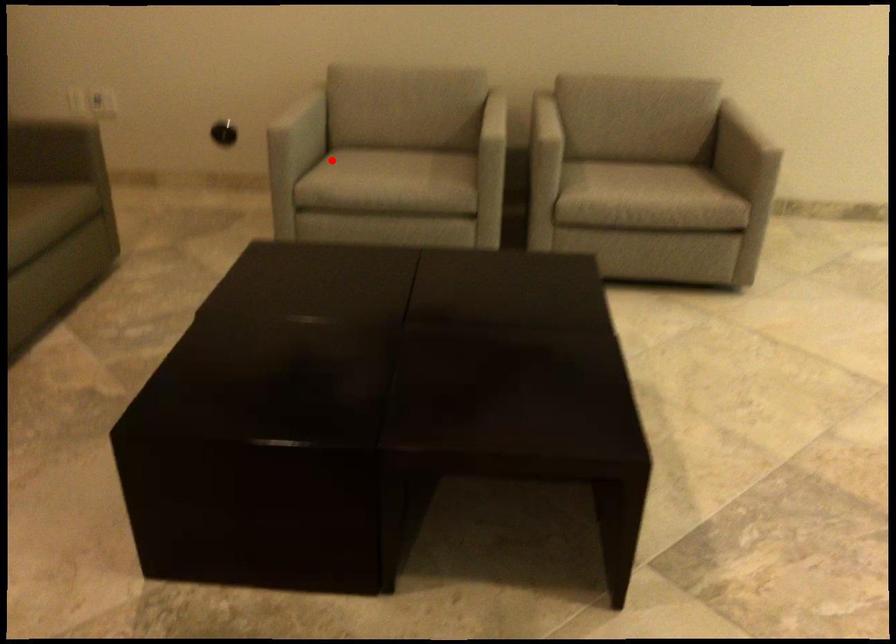
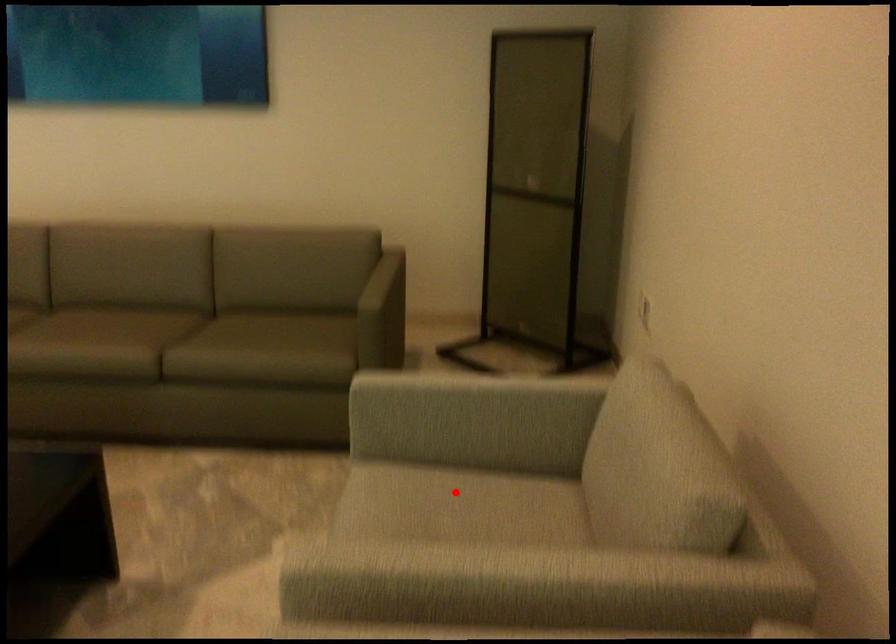
I am providing you with two images of the same scene from different viewpoints. A red point is marked on the first image and another point is marked on the second image. Is the red point in image1 aligned with the point shown in image2?

Yes